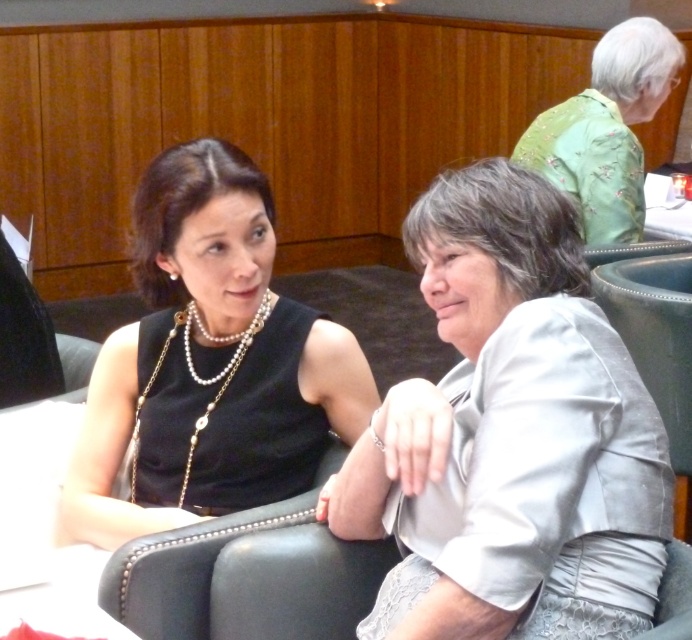
Question: Can you confirm if satin gray blouse at center is wider than green embroidered blouse at upper right?

Choices:
 (A) no
 (B) yes

Answer: (A)

Question: Which object appears closest to the camera in this image?

Choices:
 (A) satin gray blouse at center
 (B) black satin dress at center

Answer: (A)

Question: Among these points, which one is farthest from the camera?

Choices:
 (A) (621, 44)
 (B) (599, 268)
 (C) (185, 321)

Answer: (A)

Question: Can you confirm if green embroidered blouse at upper right is positioned to the right of white glossy table at upper right?

Choices:
 (A) yes
 (B) no

Answer: (B)

Question: Can you confirm if satin gray blouse at center is smaller than green embroidered blouse at upper right?

Choices:
 (A) no
 (B) yes

Answer: (B)

Question: Which of the following is the farthest from the observer?

Choices:
 (A) leather-like gray chair at right
 (B) black satin dress at center
 (C) satin gray blouse at center
 (D) pearl/pearl-like beads necklace at upper center

Answer: (A)